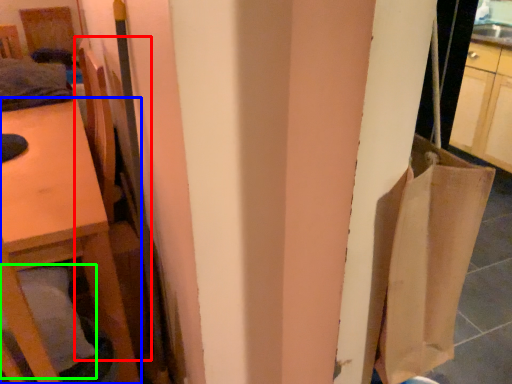
Question: Which is farther away from chair (highlighted by a red box)? furniture (highlighted by a blue box) or pillow (highlighted by a green box)?

Choices:
 (A) furniture
 (B) pillow

Answer: (B)